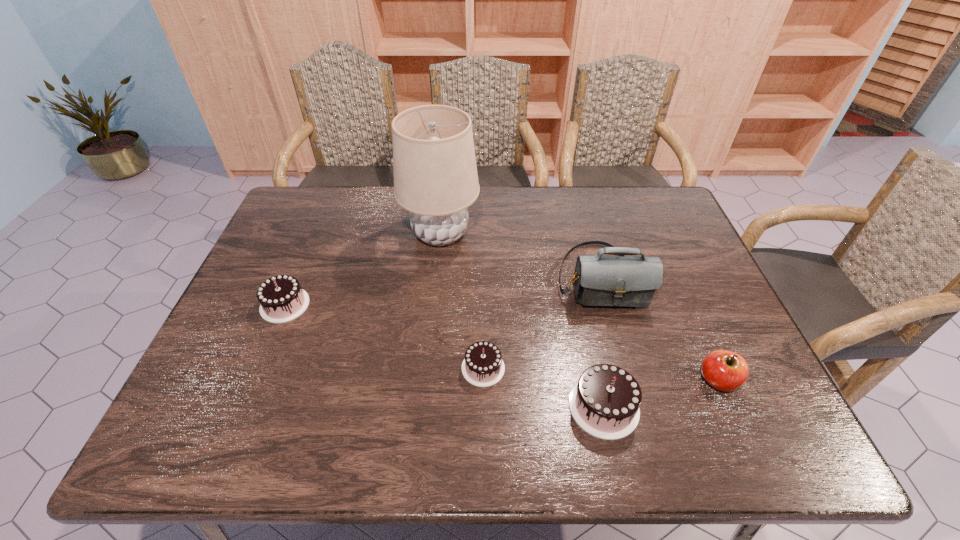
You are a GUI agent. You are given a task and a screenshot of the screen. Output one action in this format:
    pyautogui.click(x=<x>, y=<y>)
    Task: Click on the spot to insert another chocolate_cake for uniform distribution
    The width and height of the screenshot is (960, 540).
    Given the screenshot: What is the action you would take?
    pyautogui.click(x=378, y=335)